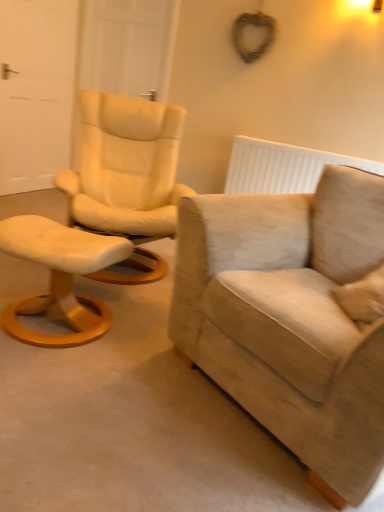
Find the location of a particular element. The height and width of the screenshot is (512, 384). vacant area that is in front of white fabric stool at left is located at coordinates (62, 394).